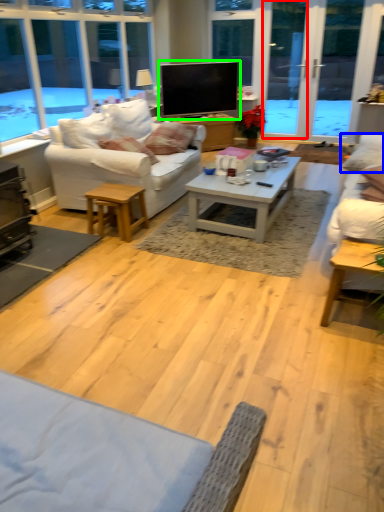
Question: Considering the real-world distances, which object is closest to screen door (highlighted by a red box)? pillow (highlighted by a blue box) or television (highlighted by a green box).

Choices:
 (A) pillow
 (B) television

Answer: (B)